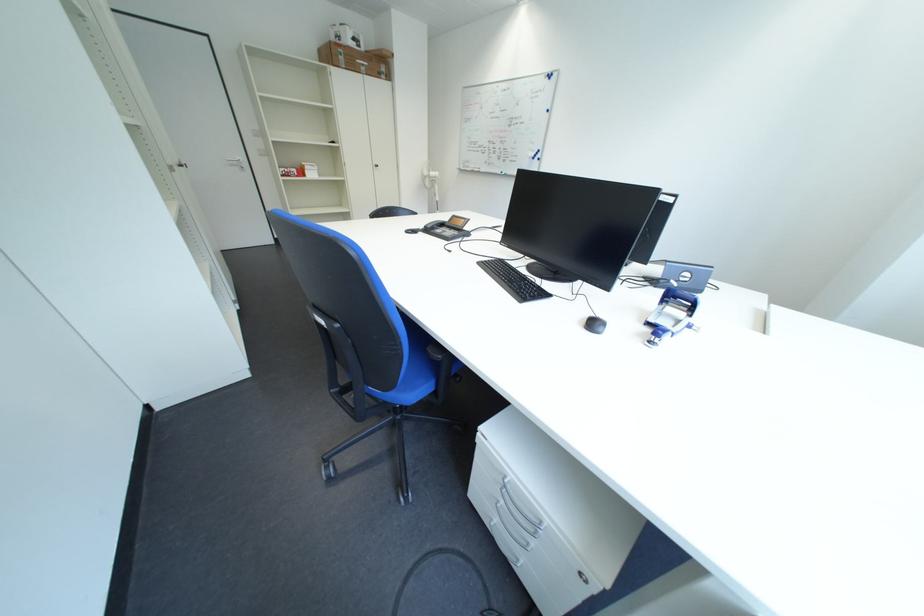
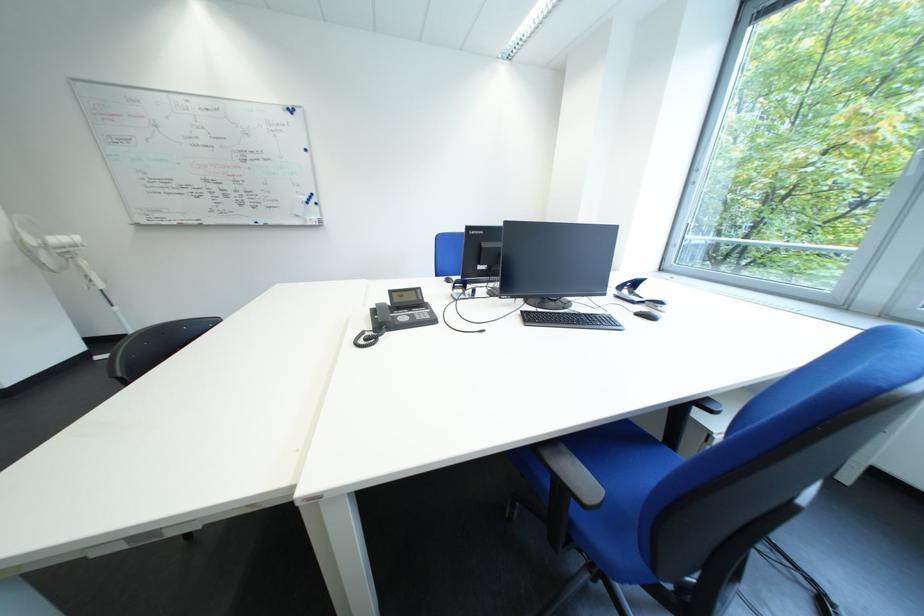
Locate, in the second image, the point that corresponds to point 451,233 in the first image.

(416, 320)